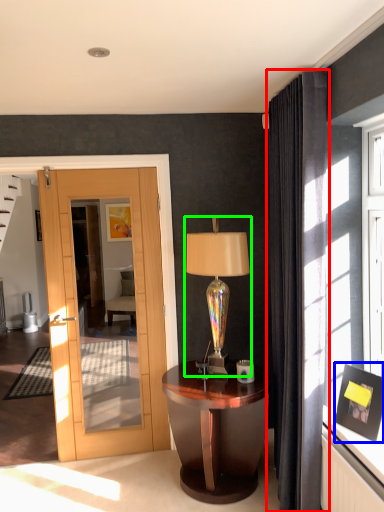
Question: Which is nearer to the curtain (highlighted by a red box)? picture frame (highlighted by a blue box) or table lamp (highlighted by a green box).

Choices:
 (A) picture frame
 (B) table lamp

Answer: (A)